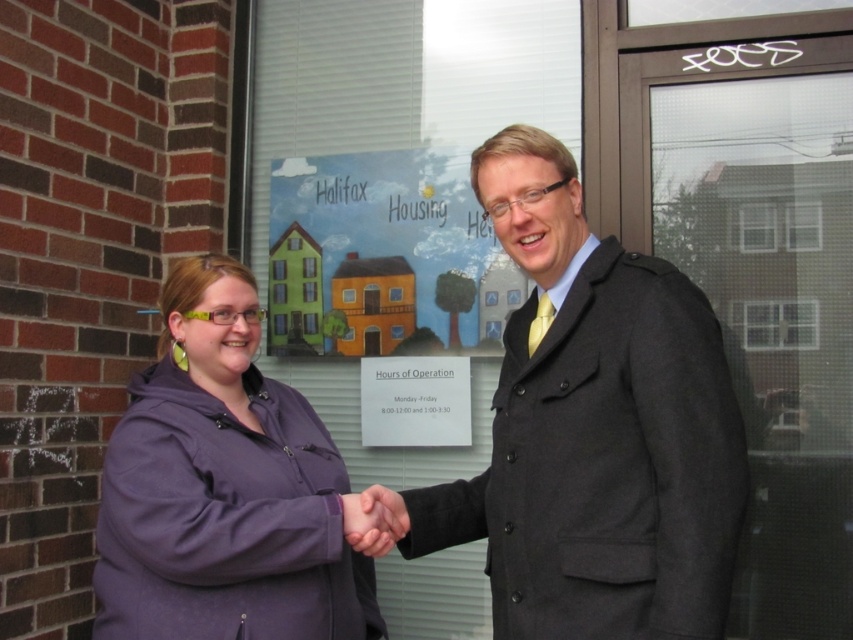
You are a photographer trying to capture a group photo of the two people in the scene. You need to ensure that both the dark gray wool coat at center and the purple fleece jacket at center are fully visible in the frame. Based on their sizes, do you think you might need to adjust the camera angle to accommodate their widths?

The dark gray wool coat at center might be wider than the purple fleece jacket at center, so adjusting the camera angle could help ensure both are fully visible in the frame.

You are a photographer standing in front of the two people. You want to take a photo where the dark gray wool coat at center is in focus while keeping the purple fleece jacket at center somewhat visible but not too clear. Is the current arrangement suitable for this?

The dark gray wool coat at center is closer to the viewer than purple fleece jacket at center, so yes, the current arrangement is suitable for the photo as the closer object will be in focus while the background object remains somewhat visible but less clear.